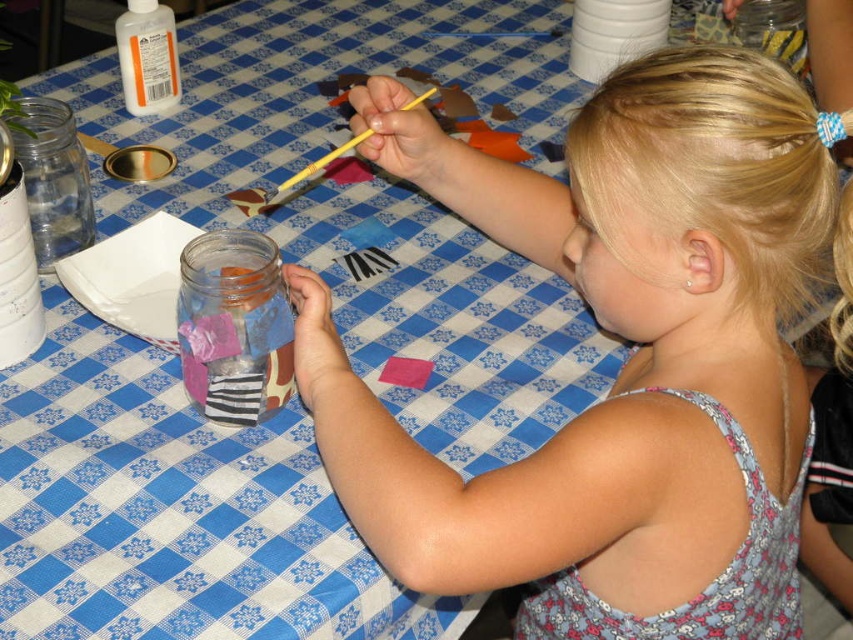
Does transparent glass jar at center appear under yellow wood pencil at upper center?

Yes, transparent glass jar at center is below yellow wood pencil at upper center.

Which is in front, point (270, 346) or point (332, 154)?

Positioned in front is point (270, 346).

Measure the distance between transparent glass jar at center and camera.

transparent glass jar at center is 63.77 centimeters away from camera.

The height and width of the screenshot is (640, 853). I want to click on transparent glass jar at center, so click(x=234, y=326).

In the scene shown: Between blonde hair at upper right and clear glass jar at left, which one appears on the left side from the viewer's perspective?

clear glass jar at left

Can you confirm if blonde hair at upper right is shorter than clear glass jar at left?

In fact, blonde hair at upper right may be taller than clear glass jar at left.

This screenshot has height=640, width=853. Identify the location of blonde hair at upper right. (625, 362).

Can you confirm if blonde hair at upper right is shorter than yellow wood pencil at upper center?

No, blonde hair at upper right is not shorter than yellow wood pencil at upper center.

Is point (495, 196) positioned after point (412, 100)?

Yes, point (495, 196) is farther from viewer.

The height and width of the screenshot is (640, 853). I want to click on blonde hair at upper right, so click(625, 362).